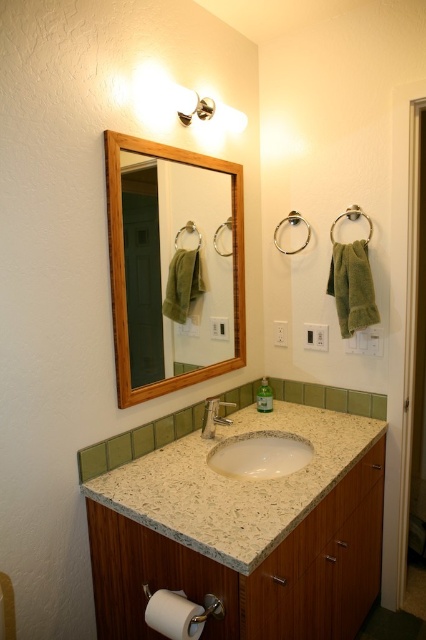
You are organizing a bathroom and want to place a decorative bowl on the counter. The bowl requires a space larger than the white granite sink at center. Do you think the white speckled granite at center has enough space?

The white speckled granite at center is bigger than the white granite sink at center, so yes, it has enough space for the decorative bowl that needs a larger area than the sink.

You are standing in front of the bathroom vanity and see two points marked on the countertop. The first point is at coordinates point (158,612), and the second point is at point (216,412). Which point is closer to you?

Point (158,612) is in front of point (216,412), so it is closer to you.

You are organizing items on the bathroom vanity. You need to place a new toothbrush holder between the silver metallic faucet at center and the green matte soap dispenser at center. Based on their positions, where should you place the toothbrush holder in relation to the faucet and dispenser?

The silver metallic faucet at center is below the green matte soap dispenser at center, so the toothbrush holder should be placed between them vertically, above the faucet and below the soap dispenser.